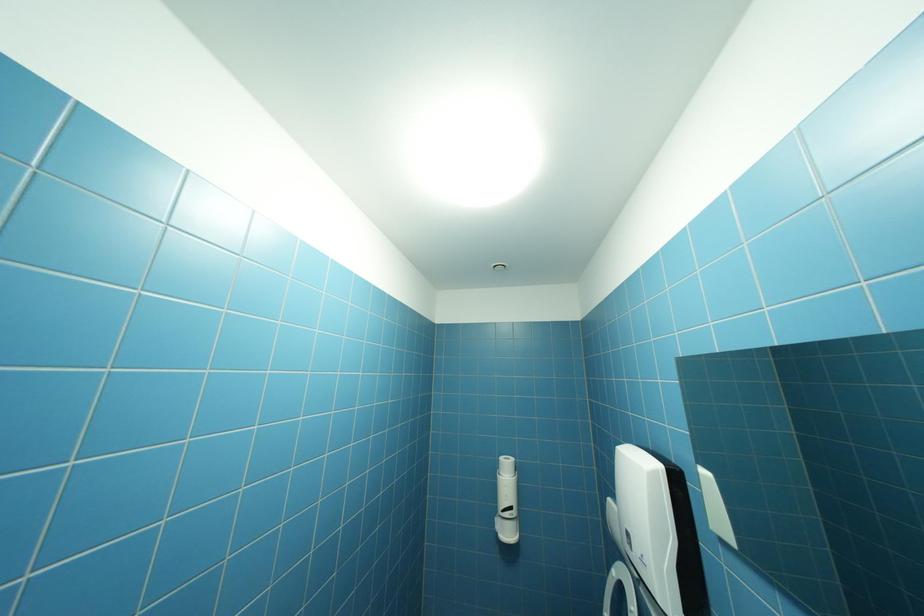
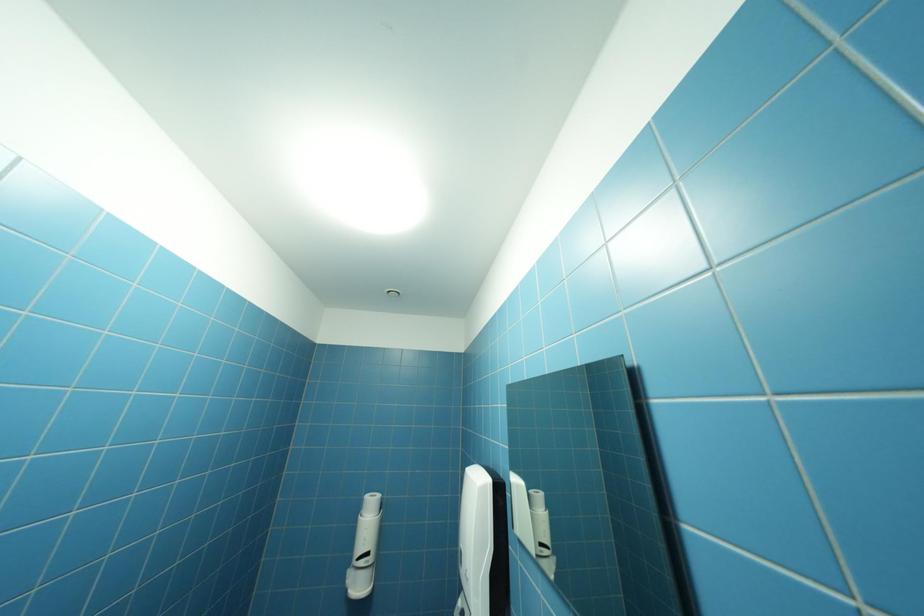
Question: The camera is either moving clockwise (left) or counter-clockwise (right) around the object. The first image is from the beginning of the video and the second image is from the end. Is the camera moving left or right when shooting the video?

Choices:
 (A) Left
 (B) Right

Answer: (A)